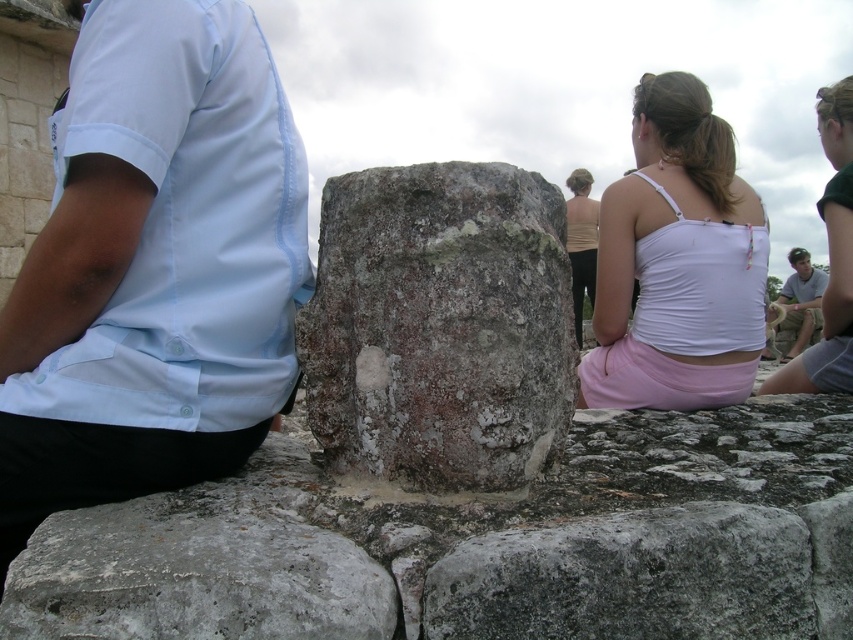
Does point (409, 356) come behind point (846, 96)?

That is False.

Based on the photo, can you confirm if rusty stone boulder at center is thinner than light gray stone statue at upper right?

No.

Between point (500, 316) and point (825, 132), which one is positioned in front?

Point (500, 316) is in front.

Locate an element on the screen. rusty stone boulder at center is located at coordinates (x=440, y=326).

Is point (436, 620) farther from camera compared to point (579, 193)?

No, (436, 620) is closer to viewer.

Which is below, gray stone boulder at center or beige fabric top at center?

gray stone boulder at center is below.

What do you see at coordinates (630, 579) in the screenshot?
I see `gray stone boulder at center` at bounding box center [630, 579].

At what (x,y) coordinates should I click in order to perform the action: click on gray stone boulder at center. Please return your answer as a coordinate pair (x, y). This screenshot has width=853, height=640. Looking at the image, I should click on (630, 579).

Does rusty stone boulder at center have a lesser width compared to white fabric tank top at upper right?

Indeed, rusty stone boulder at center has a lesser width compared to white fabric tank top at upper right.

Who is more forward, (x=512, y=317) or (x=636, y=371)?

Point (x=512, y=317) is more forward.

This screenshot has width=853, height=640. In order to click on rusty stone boulder at center in this screenshot , I will do `click(440, 326)`.